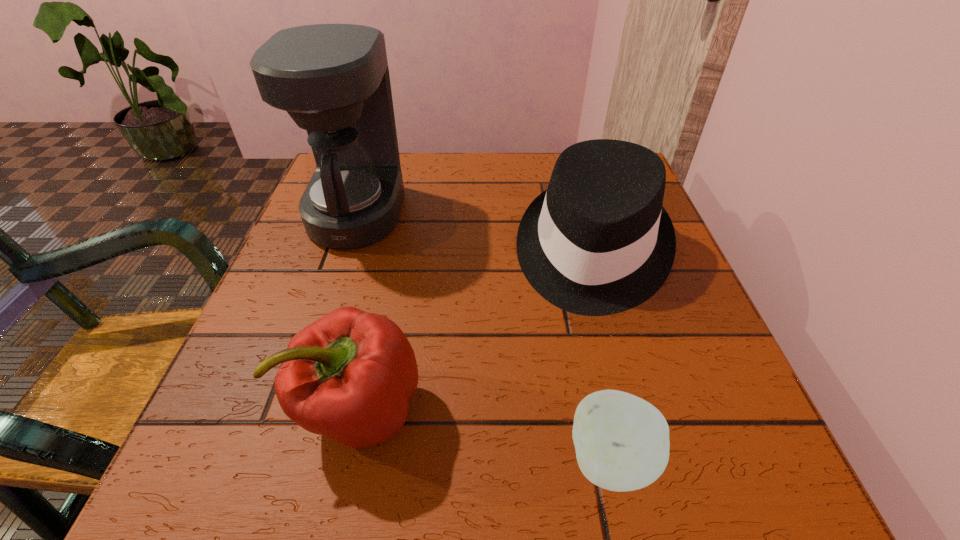
Identify the location of bell pepper that is positioned at the near edge. (349, 376).

Locate an element on the screen. apple situated at the near edge is located at coordinates (622, 443).

Image resolution: width=960 pixels, height=540 pixels. I want to click on coffee maker situated at the left edge, so click(x=333, y=80).

The image size is (960, 540). I want to click on bell pepper positioned at the left edge, so click(x=349, y=376).

In order to click on fedora at the right edge in this screenshot , I will do pos(598,241).

Locate an element on the screen. The height and width of the screenshot is (540, 960). apple positioned at the right edge is located at coordinates (622, 443).

Locate an element on the screen. object located in the far left corner section of the desktop is located at coordinates (333, 80).

The height and width of the screenshot is (540, 960). I want to click on object present at the near left corner, so click(x=349, y=376).

Locate an element on the screen. object at the far right corner is located at coordinates (598, 241).

Find the location of a particular element. This screenshot has width=960, height=540. object at the near right corner is located at coordinates (622, 443).